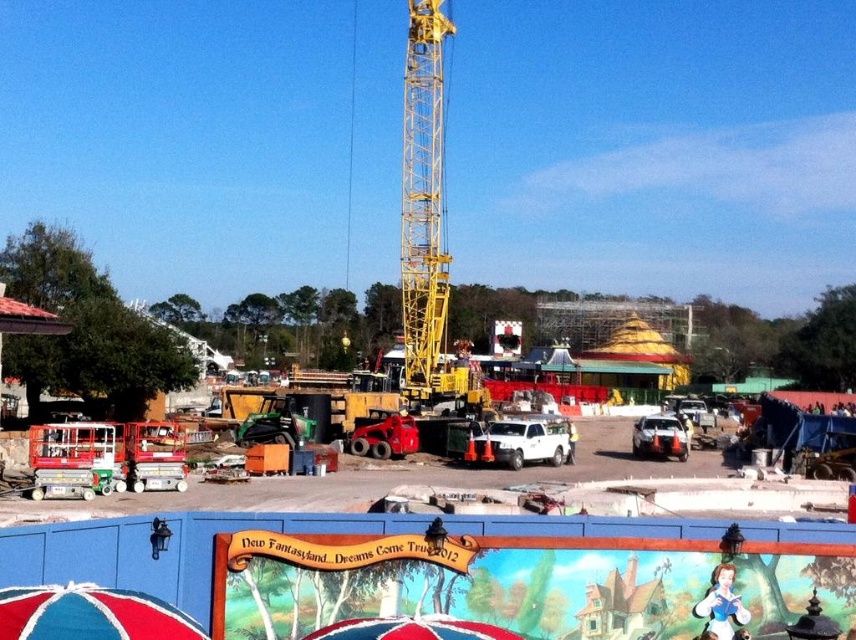
You are a visitor at the Disney World construction site and want to take a photo of both the red fabric umbrella at lower left and the metallic silver car at center. Since you have a camera with a fixed focal length, you need to know which object is narrower so you can adjust your framing. Which object is narrower?

The red fabric umbrella at lower left is narrower than the metallic silver car at center, so you should frame the shot to accommodate its smaller width while ensuring the car is also in view.